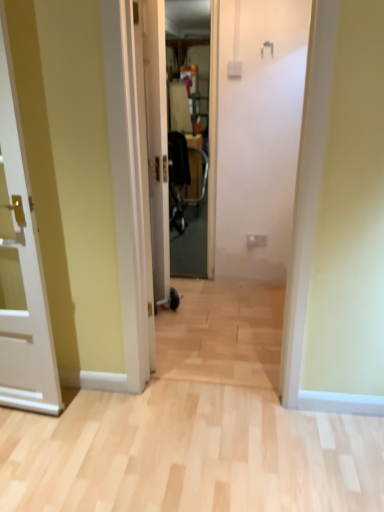
You are a GUI agent. You are given a task and a screenshot of the screen. Output one action in this format:
    pyautogui.click(x=<x>, y=<y>)
    Task: Click on the vacant space underneath white glossy door at left, which is the second door in right-to-left order (from a real-world perspective)
    
    Given the screenshot: What is the action you would take?
    click(x=28, y=445)